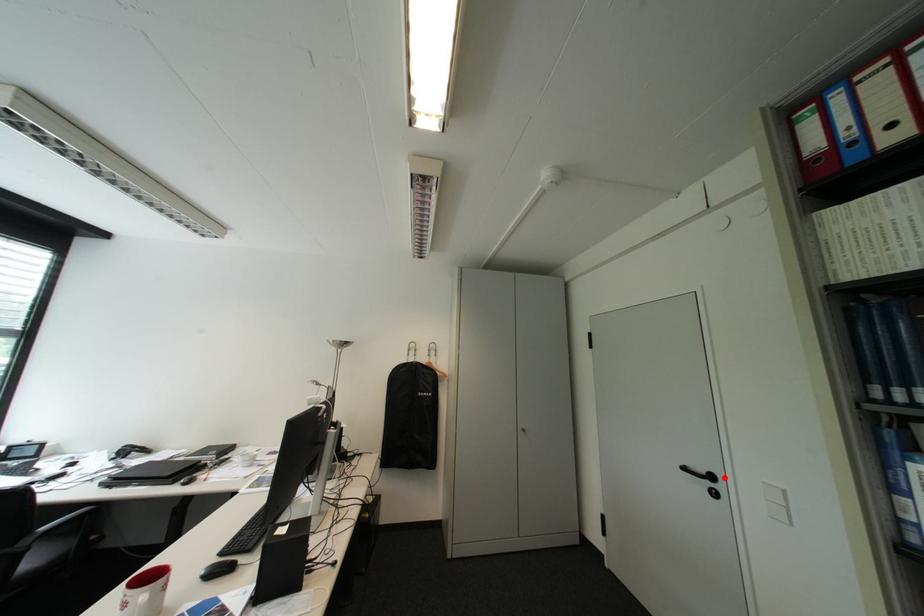
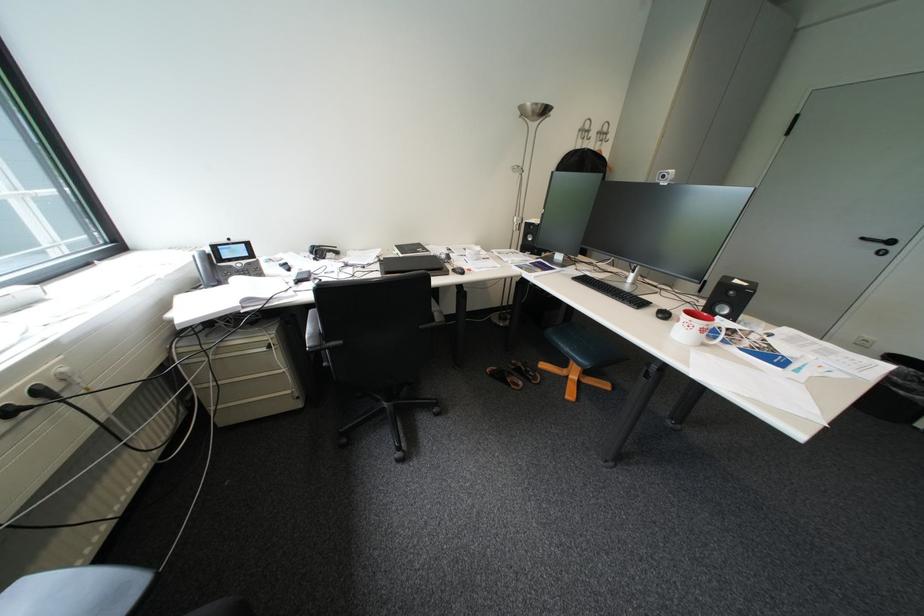
Question: I am providing you with two images of the same scene from different viewpoints. A red point is marked on the first image. Can you still see the location of the red point in image 2?

Choices:
 (A) Yes
 (B) No

Answer: (A)